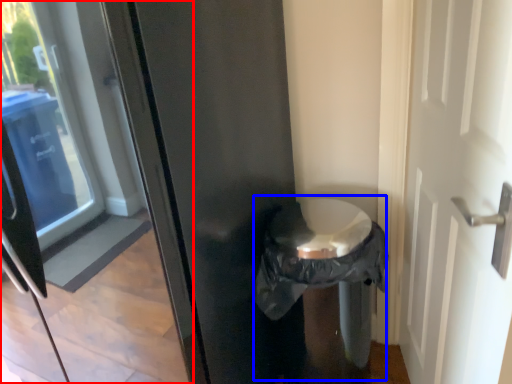
Question: Which object is further to the camera taking this photo, glass door (highlighted by a red box) or garbage (highlighted by a blue box)?

Choices:
 (A) glass door
 (B) garbage

Answer: (B)